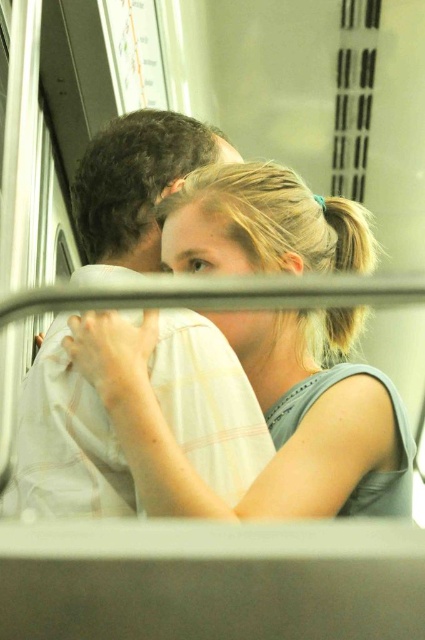
Question: Is light gray fabric shirt at center bigger than white cotton shirt at center?

Choices:
 (A) no
 (B) yes

Answer: (B)

Question: Which point is farther from the camera taking this photo?

Choices:
 (A) (385, 449)
 (B) (87, 228)

Answer: (B)

Question: Which of the following is the farthest from the observer?

Choices:
 (A) (331, 420)
 (B) (56, 460)

Answer: (B)

Question: Does light gray fabric shirt at center have a lesser width compared to white cotton shirt at center?

Choices:
 (A) yes
 (B) no

Answer: (B)

Question: Can you confirm if light gray fabric shirt at center is smaller than white cotton shirt at center?

Choices:
 (A) no
 (B) yes

Answer: (A)

Question: Which of the following is the closest to the observer?

Choices:
 (A) white cotton shirt at center
 (B) light gray fabric shirt at center

Answer: (A)